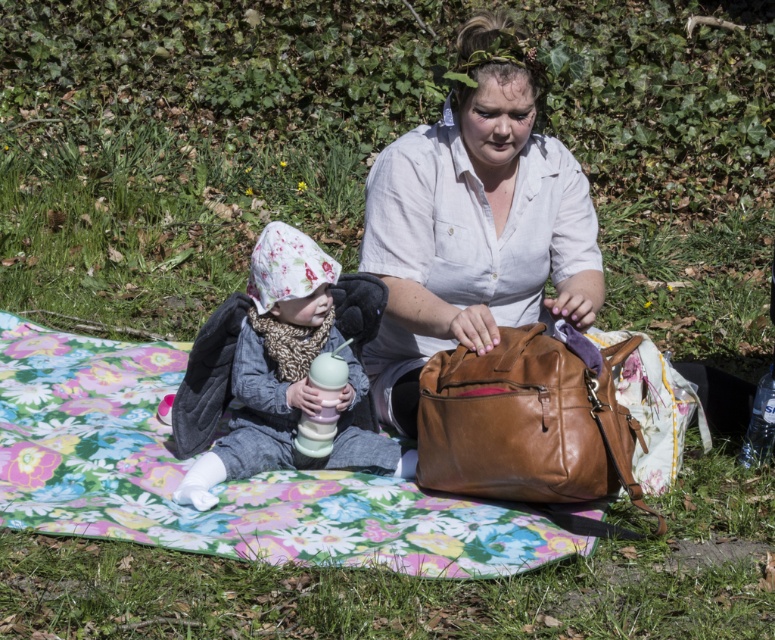
From the picture: Can you confirm if brown leather bag at center is taller than clear plastic bottle at lower right?

Yes.

Does brown leather bag at center lie in front of clear plastic bottle at lower right?

Yes, it is.

What do you see at coordinates (529, 426) in the screenshot? I see `brown leather bag at center` at bounding box center [529, 426].

Where is `brown leather bag at center`? The height and width of the screenshot is (640, 775). brown leather bag at center is located at coordinates (529, 426).

Can you confirm if fluffy fleece hat at center is positioned to the right of brown leather bag at center?

In fact, fluffy fleece hat at center is to the left of brown leather bag at center.

Does point (186, 490) lie behind point (601, 486)?

Yes, point (186, 490) is farther from viewer.

You are a GUI agent. You are given a task and a screenshot of the screen. Output one action in this format:
    pyautogui.click(x=<x>, y=<y>)
    Task: Click on the fluffy fleece hat at center
    
    Given the screenshot: What is the action you would take?
    pyautogui.click(x=277, y=369)

Who is lower down, floral fabric blanket at center or matte white shirt at center?

Positioned lower is floral fabric blanket at center.

Who is more distant from viewer, (298,480) or (510,227)?

Point (510,227)

Where is `floral fabric blanket at center`? The image size is (775, 640). floral fabric blanket at center is located at coordinates (219, 484).